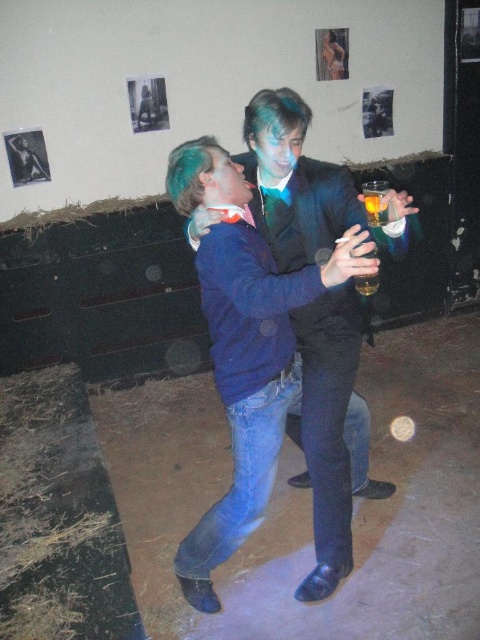
You are a photographer setting up a shoot in the described scene. You need to position a light source to the right of both the blue denim jacket at center and the translucent glass at upper right. Is this possible? Explain why or why not based on their positions.

The blue denim jacket at center is to the left of the translucent glass at upper right, so positioning a light source to the right of both would be possible since the translucent glass at upper right is already on the right side of the jacket. The light can be placed further to the right of the glass.

You are standing in the middle of the room. The blue denim jacket at center is represented by point (330, 429). Where is the blue denim jacket at center located relative to the point you are standing?

The blue denim jacket at center is located at the coordinates (330, 429) relative to your position in the room.